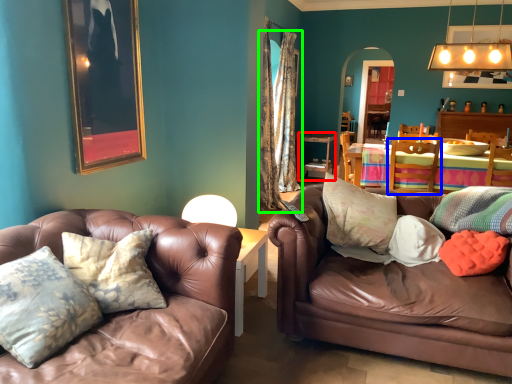
Question: Estimate the real-world distances between objects in this image. Which object is farther from table (highlighted by a red box), chair (highlighted by a blue box) or curtain (highlighted by a green box)?

Choices:
 (A) chair
 (B) curtain

Answer: (A)